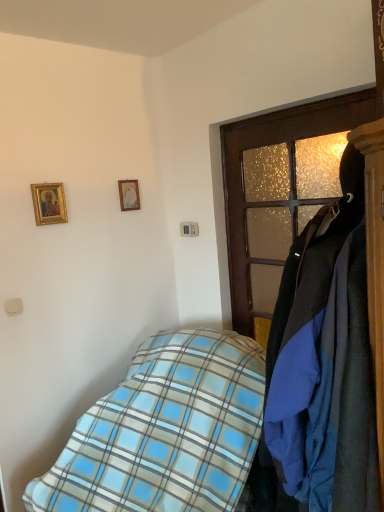
Measure the distance between point (x=182, y=475) and camera.

A distance of 5.45 feet exists between point (x=182, y=475) and camera.

You are a GUI agent. You are given a task and a screenshot of the screen. Output one action in this format:
    pyautogui.click(x=<x>, y=<y>)
    Task: Click on the wooden door at right
    The image size is (384, 512).
    Given the screenshot: What is the action you would take?
    pyautogui.click(x=275, y=181)

Measure the distance between wooden door at right and camera.

A distance of 5.08 feet exists between wooden door at right and camera.

Where is `wooden picture frame at upper center, which is the first picture frame in back-to-front order`? wooden picture frame at upper center, which is the first picture frame in back-to-front order is located at coordinates (129, 194).

How many degrees apart are the facing directions of blue plaid blanket at lower left, the 1th bed viewed from the front, and wooden door at right?

There is a 8.92-degree angle between the facing directions of blue plaid blanket at lower left, the 1th bed viewed from the front, and wooden door at right.

Is point (205, 439) closer or farther from the camera than point (268, 125)?

Point (205, 439).

Can you confirm if blue plaid blanket at lower left, the 1th bed viewed from the front, is smaller than wooden door at right?

No, blue plaid blanket at lower left, the 1th bed viewed from the front, is not smaller than wooden door at right.

From the image's perspective, is blue plaid blanket at lower left, the 1th bed viewed from the front, located above or below wooden door at right?

Clearly, from the image's perspective, blue plaid blanket at lower left, the 1th bed viewed from the front, is below wooden door at right.

Is wooden picture frame at upper center, the 1th picture frame from the right, looking in the opposite direction of blue plaid blanket at lower left, the 1th bed viewed from the front?

No.

Are wooden picture frame at upper center, the second picture frame when ordered from front to back, and blue plaid blanket at lower left, the 1th bed viewed from the front, far apart?

Yes.

From a real-world perspective, is wooden picture frame at upper center, the second picture frame in the left-to-right sequence, physically above blue plaid blanket at lower left, the 1th bed viewed from the front?

Yes, from a real-world perspective, wooden picture frame at upper center, the second picture frame in the left-to-right sequence, is on top of blue plaid blanket at lower left, the 1th bed viewed from the front.

This screenshot has width=384, height=512. I want to click on the 2nd bed to the right of the wooden picture frame at upper center, the second picture frame in the left-to-right sequence, counting from the anchor's position, so click(x=247, y=395).

Is there a large distance between gold-framed painting at upper left, acting as the second picture frame starting from the back, and blue plaid blanket at lower left, the 1th bed viewed from the front?

Yes, gold-framed painting at upper left, acting as the second picture frame starting from the back, is far from blue plaid blanket at lower left, the 1th bed viewed from the front.

From the image's perspective, which one is positioned higher, gold-framed painting at upper left, which is the 1th picture frame in front-to-back order, or blue plaid blanket at lower left, the 1th bed viewed from the front?

gold-framed painting at upper left, which is the 1th picture frame in front-to-back order, is shown above in the image.

Which object is closer to the camera taking this photo, gold-framed painting at upper left, which is the 1th picture frame in front-to-back order, or blue plaid blanket at lower left, the 1th bed viewed from the front?

blue plaid blanket at lower left, the 1th bed viewed from the front, is closer to the camera.

How many degrees apart are the facing directions of gold-framed painting at upper left, which is the 1th picture frame in front-to-back order, and blue plaid blanket at lower left, the 1th bed viewed from the front?

The facing directions of gold-framed painting at upper left, which is the 1th picture frame in front-to-back order, and blue plaid blanket at lower left, the 1th bed viewed from the front, are 81 degrees apart.

Which is behind, gold-framed painting at upper left, which is counted as the 2th picture frame, starting from the right, or blue plaid blanket at lower left, arranged as the second bed when viewed from the front?

gold-framed painting at upper left, which is counted as the 2th picture frame, starting from the right, is more distant.

Is gold-framed painting at upper left, acting as the second picture frame starting from the back, wider or thinner than blue plaid blanket at lower left, which is counted as the first bed, starting from the back?

Clearly, gold-framed painting at upper left, acting as the second picture frame starting from the back, has less width compared to blue plaid blanket at lower left, which is counted as the first bed, starting from the back.

Could you tell me if gold-framed painting at upper left, the 1th picture frame from the left, is turned towards blue plaid blanket at lower left, which is counted as the first bed, starting from the back?

No, gold-framed painting at upper left, the 1th picture frame from the left, is not aimed at blue plaid blanket at lower left, which is counted as the first bed, starting from the back.

From the image's perspective, is gold-framed painting at upper left, acting as the second picture frame starting from the back, on top of blue plaid blanket at lower left, which is counted as the first bed, starting from the back?

Indeed, from the image's perspective, gold-framed painting at upper left, acting as the second picture frame starting from the back, is shown above blue plaid blanket at lower left, which is counted as the first bed, starting from the back.

Who is shorter, blue plaid blanket at lower left, the second bed viewed from the back, or gold-framed painting at upper left, acting as the second picture frame starting from the back?

gold-framed painting at upper left, acting as the second picture frame starting from the back, is shorter.

Does blue plaid blanket at lower left, the 1th bed viewed from the front, come behind gold-framed painting at upper left, the 1th picture frame from the left?

No, the depth of blue plaid blanket at lower left, the 1th bed viewed from the front, is less than that of gold-framed painting at upper left, the 1th picture frame from the left.

Based on their sizes in the image, would you say blue plaid blanket at lower left, the 1th bed viewed from the front, is bigger or smaller than gold-framed painting at upper left, acting as the second picture frame starting from the back?

blue plaid blanket at lower left, the 1th bed viewed from the front, is bigger than gold-framed painting at upper left, acting as the second picture frame starting from the back.

Is blue plaid blanket at lower left, which is counted as the first bed, starting from the back, located outside wooden picture frame at upper center, the second picture frame in the left-to-right sequence?

Absolutely, blue plaid blanket at lower left, which is counted as the first bed, starting from the back, is external to wooden picture frame at upper center, the second picture frame in the left-to-right sequence.

From a real-world perspective, does blue plaid blanket at lower left, which is counted as the first bed, starting from the back, sit lower than wooden picture frame at upper center, which is the first picture frame in back-to-front order?

Correct, in the physical world, blue plaid blanket at lower left, which is counted as the first bed, starting from the back, is lower than wooden picture frame at upper center, which is the first picture frame in back-to-front order.

In terms of width, does blue plaid blanket at lower left, arranged as the second bed when viewed from the front, look wider or thinner when compared to wooden picture frame at upper center, which is the first picture frame in back-to-front order?

blue plaid blanket at lower left, arranged as the second bed when viewed from the front, is wider than wooden picture frame at upper center, which is the first picture frame in back-to-front order.

Considering the positions of point (107, 428) and point (127, 205), is point (107, 428) closer or farther from the camera than point (127, 205)?

Point (107, 428) appears to be closer to the viewer than point (127, 205).

Is blue plaid blanket at lower left, the second bed viewed from the back, taller or shorter than blue plaid blanket at lower left, which is counted as the first bed, starting from the back?

Clearly, blue plaid blanket at lower left, the second bed viewed from the back, is taller compared to blue plaid blanket at lower left, which is counted as the first bed, starting from the back.

Which of these two, blue plaid blanket at lower left, the second bed viewed from the back, or blue plaid blanket at lower left, which is counted as the first bed, starting from the back, is wider?

blue plaid blanket at lower left, which is counted as the first bed, starting from the back.

From the picture: Considering the sizes of objects blue plaid blanket at lower left, the 1th bed viewed from the front, and blue plaid blanket at lower left, which is counted as the first bed, starting from the back, in the image provided, who is smaller, blue plaid blanket at lower left, the 1th bed viewed from the front, or blue plaid blanket at lower left, which is counted as the first bed, starting from the back,?

blue plaid blanket at lower left, the 1th bed viewed from the front.

The width and height of the screenshot is (384, 512). I want to click on door above the blue plaid blanket at lower left, the second bed viewed from the back (from a real-world perspective), so click(x=275, y=181).

Where is `picture frame that is the 1st one when counting leftward from the blue plaid blanket at lower left, the 1th bed viewed from the front`? The height and width of the screenshot is (512, 384). picture frame that is the 1st one when counting leftward from the blue plaid blanket at lower left, the 1th bed viewed from the front is located at coordinates (129, 194).

When comparing their distances from blue plaid blanket at lower left, arranged as the second bed when viewed from the front, does blue plaid blanket at lower left, the second bed viewed from the back, or wooden picture frame at upper center, the second picture frame in the left-to-right sequence, seem closer?

The object closer to blue plaid blanket at lower left, arranged as the second bed when viewed from the front, is blue plaid blanket at lower left, the second bed viewed from the back.

From the image, which object appears to be farther from blue plaid blanket at lower left, arranged as the second bed when viewed from the front, wooden picture frame at upper center, the second picture frame when ordered from front to back, or wooden door at right?

wooden picture frame at upper center, the second picture frame when ordered from front to back, lies further to blue plaid blanket at lower left, arranged as the second bed when viewed from the front, than the other object.

When comparing their distances from wooden door at right, does blue plaid blanket at lower left, which is counted as the first bed, starting from the back, or blue plaid blanket at lower left, the second bed viewed from the back, seem further?

Among the two, blue plaid blanket at lower left, the second bed viewed from the back, is located further to wooden door at right.

When comparing their distances from blue plaid blanket at lower left, arranged as the second bed when viewed from the front, does wooden door at right or gold-framed painting at upper left, which is the 1th picture frame in front-to-back order, seem closer?

wooden door at right lies closer to blue plaid blanket at lower left, arranged as the second bed when viewed from the front, than the other object.

Considering their positions, is gold-framed painting at upper left, which is the 1th picture frame in front-to-back order, positioned closer to wooden door at right than blue plaid blanket at lower left, the 1th bed viewed from the front?

blue plaid blanket at lower left, the 1th bed viewed from the front, is closer to wooden door at right.

Considering their positions, is blue plaid blanket at lower left, the 1th bed viewed from the front, positioned closer to blue plaid blanket at lower left, arranged as the second bed when viewed from the front, than wooden door at right?

Among the two, blue plaid blanket at lower left, the 1th bed viewed from the front, is located nearer to blue plaid blanket at lower left, arranged as the second bed when viewed from the front.

Looking at the image, which one is located further to gold-framed painting at upper left, acting as the second picture frame starting from the back, blue plaid blanket at lower left, which is counted as the first bed, starting from the back, or blue plaid blanket at lower left, the 1th bed viewed from the front?

blue plaid blanket at lower left, which is counted as the first bed, starting from the back, lies further to gold-framed painting at upper left, acting as the second picture frame starting from the back, than the other object.

Looking at the image, which one is located further to gold-framed painting at upper left, the 1th picture frame from the left, blue plaid blanket at lower left, the second bed viewed from the back, or wooden picture frame at upper center, the second picture frame when ordered from front to back?

The object further to gold-framed painting at upper left, the 1th picture frame from the left, is blue plaid blanket at lower left, the second bed viewed from the back.

The image size is (384, 512). Identify the location of picture frame between gold-framed painting at upper left, acting as the second picture frame starting from the back, and wooden door at right from left to right. (129, 194).

Where is `door between blue plaid blanket at lower left, the second bed viewed from the back, and wooden picture frame at upper center, the 1th picture frame from the right, along the z-axis`? The width and height of the screenshot is (384, 512). door between blue plaid blanket at lower left, the second bed viewed from the back, and wooden picture frame at upper center, the 1th picture frame from the right, along the z-axis is located at coordinates (275, 181).

You are a GUI agent. You are given a task and a screenshot of the screen. Output one action in this format:
    pyautogui.click(x=<x>, y=<y>)
    Task: Click on the picture frame between blue plaid blanket at lower left, the second bed viewed from the back, and wooden picture frame at upper center, the 1th picture frame from the right, in the front-back direction
    This screenshot has width=384, height=512.
    Given the screenshot: What is the action you would take?
    pyautogui.click(x=49, y=203)

Find the location of a particular element. bed located between blue plaid blanket at lower left, the second bed viewed from the back, and wooden picture frame at upper center, the second picture frame in the left-to-right sequence, in the depth direction is located at coordinates tap(165, 431).